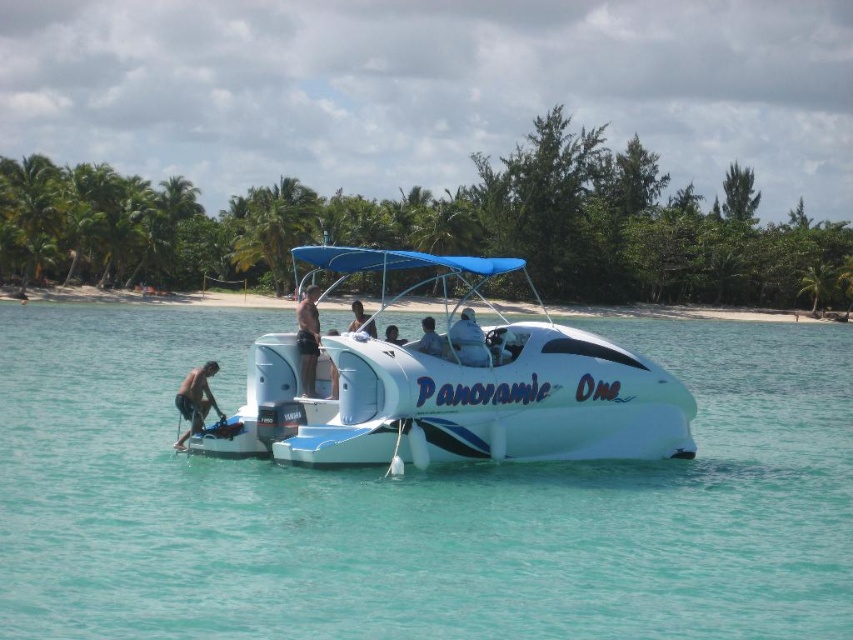
Which is above, white glossy boat at center or matte white shirt at center?

white glossy boat at center is higher up.

Between white glossy boat at center and matte white shirt at center, which one appears on the right side from the viewer's perspective?

Positioned to the right is matte white shirt at center.

Image resolution: width=853 pixels, height=640 pixels. Find the location of `white glossy boat at center`. white glossy boat at center is located at coordinates (450, 388).

Locate an element on the screen. white glossy boat at center is located at coordinates (450, 388).

Can you confirm if white glossy boat at center is positioned above smooth tan skin at center?

Yes.

Is white glossy boat at center in front of smooth tan skin at center?

Yes, it is.

Where is `white glossy boat at center`? This screenshot has height=640, width=853. white glossy boat at center is located at coordinates (450, 388).

The height and width of the screenshot is (640, 853). What are the coordinates of `white glossy boat at center` in the screenshot? It's located at (450, 388).

Who is higher up, white glossy water at center or skinny man at lower left?

skinny man at lower left

Between white glossy water at center and skinny man at lower left, which one appears on the left side from the viewer's perspective?

skinny man at lower left

Who is more distant from viewer, (x=73, y=556) or (x=200, y=371)?

The point (x=200, y=371) is behind.

Locate an element on the screen. white glossy water at center is located at coordinates (415, 500).